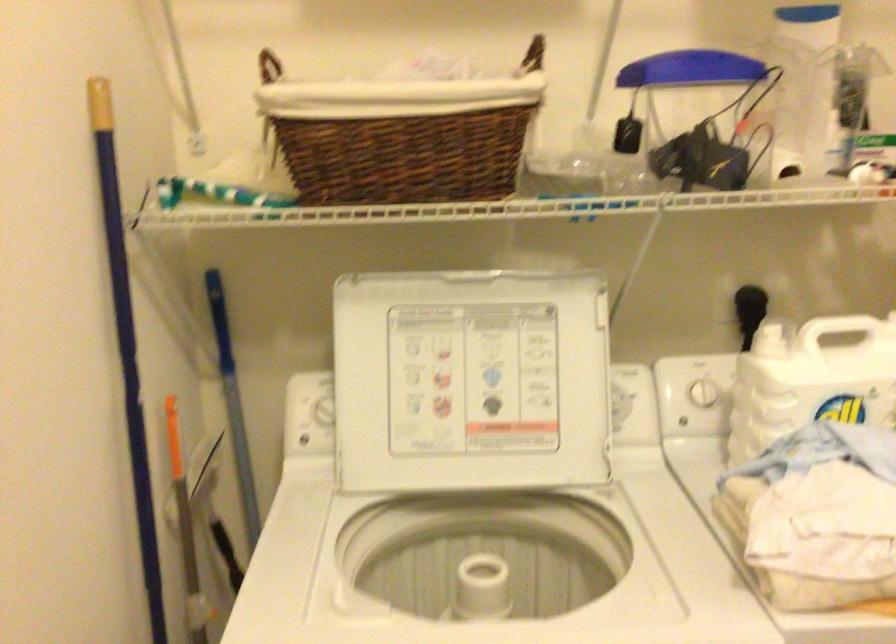
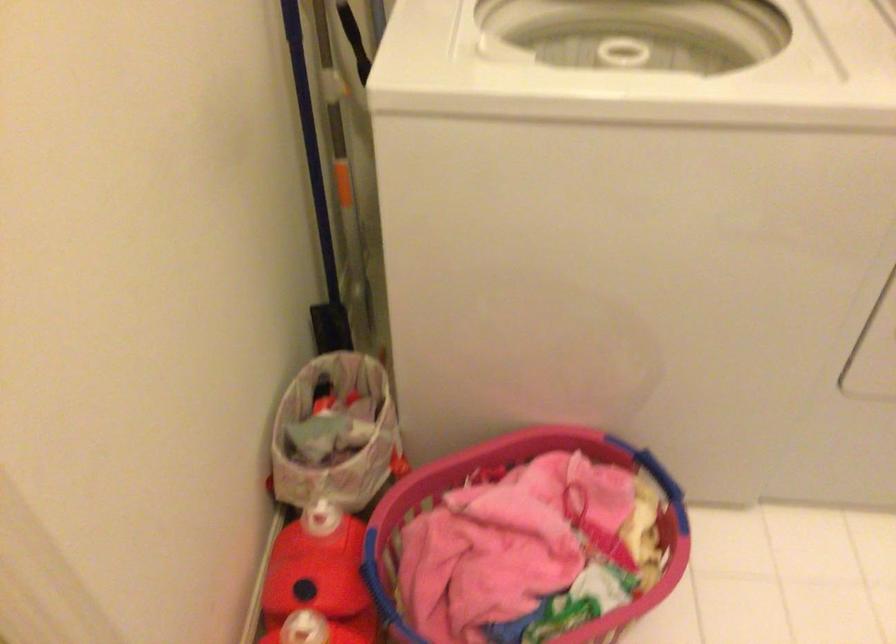
In a continuous first-person perspective shot, in which direction is the camera moving?

The cameraman walked toward left, backward.